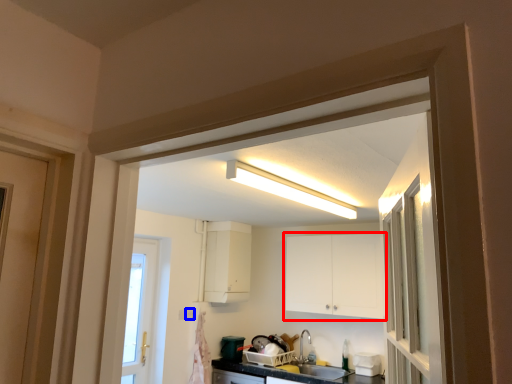
Question: Which object appears farthest to the camera in this image, cabinetry (highlighted by a red box) or electric outlet (highlighted by a blue box)?

Choices:
 (A) cabinetry
 (B) electric outlet

Answer: (B)